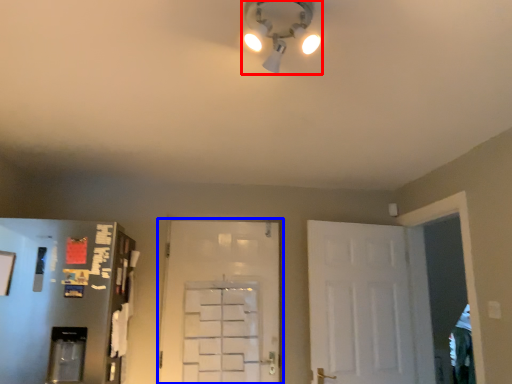
Question: Which object is further to the camera taking this photo, light fixture (highlighted by a red box) or door (highlighted by a blue box)?

Choices:
 (A) light fixture
 (B) door

Answer: (B)